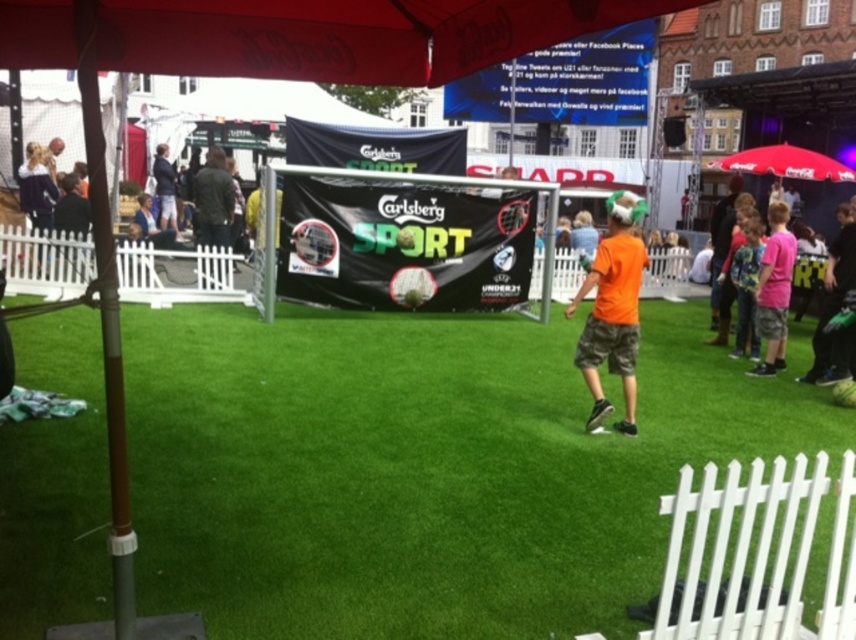
Question: Which point appears closest to the camera in this image?

Choices:
 (A) (152, 163)
 (B) (414, 371)
 (C) (592, 324)

Answer: (C)

Question: Is green artificial turf at center bigger than light blue denim shorts at center?

Choices:
 (A) no
 (B) yes

Answer: (A)

Question: Which of these objects is positioned farthest from the light blue denim shorts at center?

Choices:
 (A) green artificial turf at center
 (B) orange matte shirt at center

Answer: (B)

Question: Observing the image, what is the correct spatial positioning of orange matte shirt at center in reference to light blue denim shorts at center?

Choices:
 (A) left
 (B) right

Answer: (B)

Question: Which point appears farthest from the camera in this image?

Choices:
 (A) (788, 378)
 (B) (165, 198)

Answer: (B)

Question: Considering the relative positions of green artificial turf at center and orange matte shirt at center in the image provided, where is green artificial turf at center located with respect to orange matte shirt at center?

Choices:
 (A) below
 (B) above

Answer: (A)